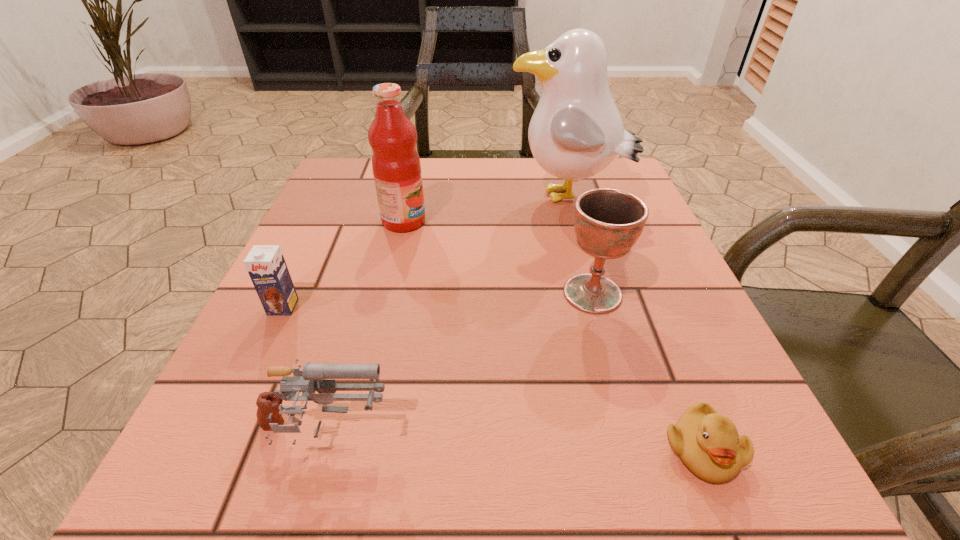
Image resolution: width=960 pixels, height=540 pixels. Find the location of `free spot at the right edge of the desktop`. free spot at the right edge of the desktop is located at coordinates (727, 396).

Find the location of a particular element. vacant region at the far right corner of the desktop is located at coordinates (591, 186).

You are a GUI agent. You are given a task and a screenshot of the screen. Output one action in this format:
    pyautogui.click(x=<x>, y=<y>)
    Task: Click on the free space between the duckling and the gun
    Image resolution: width=960 pixels, height=540 pixels.
    Given the screenshot: What is the action you would take?
    pyautogui.click(x=513, y=442)

You are a GUI agent. You are given a task and a screenshot of the screen. Output one action in this format:
    pyautogui.click(x=<x>, y=<y>)
    Task: Click on the unoccupied area between the fruit juice and the gun
    
    Given the screenshot: What is the action you would take?
    coord(364,328)

Locate an element on the screen. Image resolution: width=960 pixels, height=540 pixels. vacant space that's between the gun and the duckling is located at coordinates (513, 442).

Locate an element on the screen. vacant region between the gun and the chalice is located at coordinates (458, 363).

I want to click on blank region between the fourth shortest object and the leftmost object, so click(438, 300).

This screenshot has width=960, height=540. I want to click on vacant area that lies between the shortest object and the fruit juice, so click(553, 335).

Locate an element on the screen. Image resolution: width=960 pixels, height=540 pixels. vacant point located between the leftmost object and the gull is located at coordinates (425, 252).

Where is `free spot between the leftmost object and the fourth shortest object`? This screenshot has width=960, height=540. free spot between the leftmost object and the fourth shortest object is located at coordinates (438, 300).